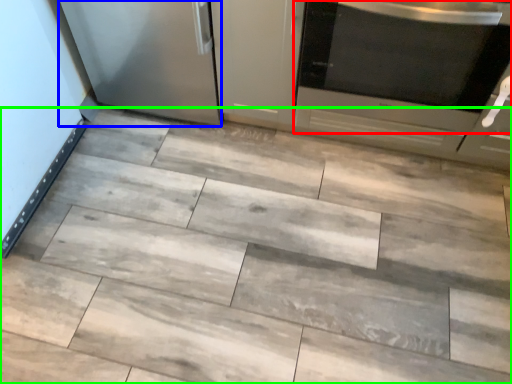
Question: Which object is the closest to the home appliance (highlighted by a red box)? Choose among these: appliance (highlighted by a blue box) or ceramic tile (highlighted by a green box).

Choices:
 (A) appliance
 (B) ceramic tile

Answer: (B)